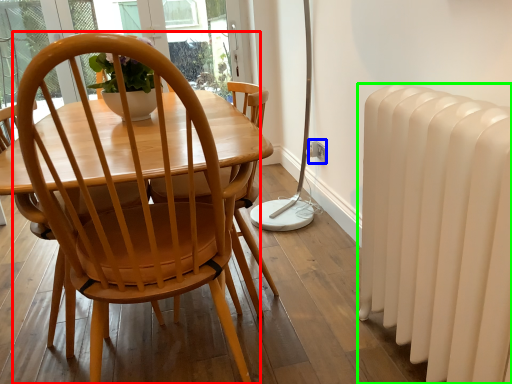
Question: Which object is positioned closest to chair (highlighted by a red box)? Select from power outlet (highlighted by a blue box) and radiator (highlighted by a green box).

Choices:
 (A) power outlet
 (B) radiator

Answer: (B)